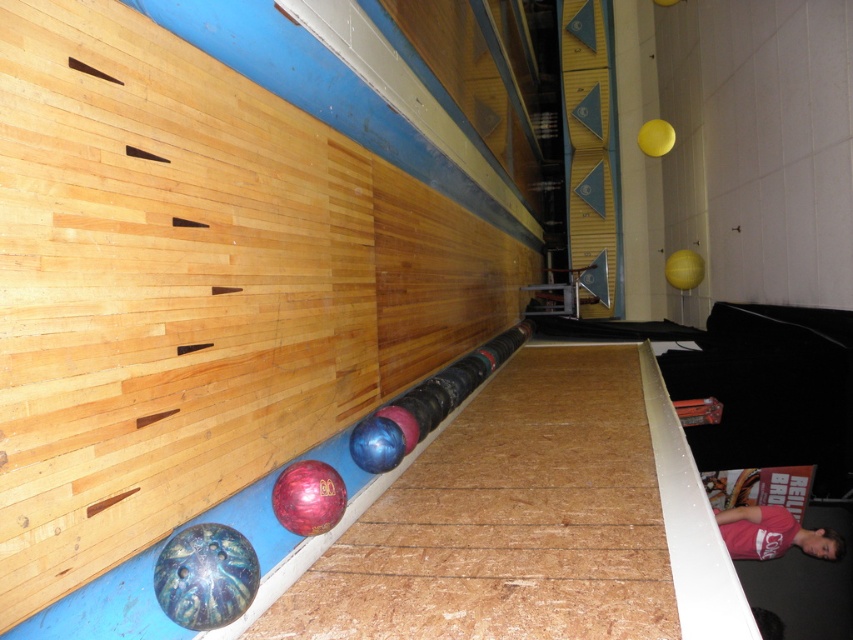
You are standing at the end of a bowling alley lane and want to pick up the shiny blue bowling ball at lower left. Based on its position coordinates, can you estimate where exactly it is located relative to the lane?

The shiny blue bowling ball at lower left is located at coordinates point (206, 577), which means it is positioned near the lower left corner of the lane.